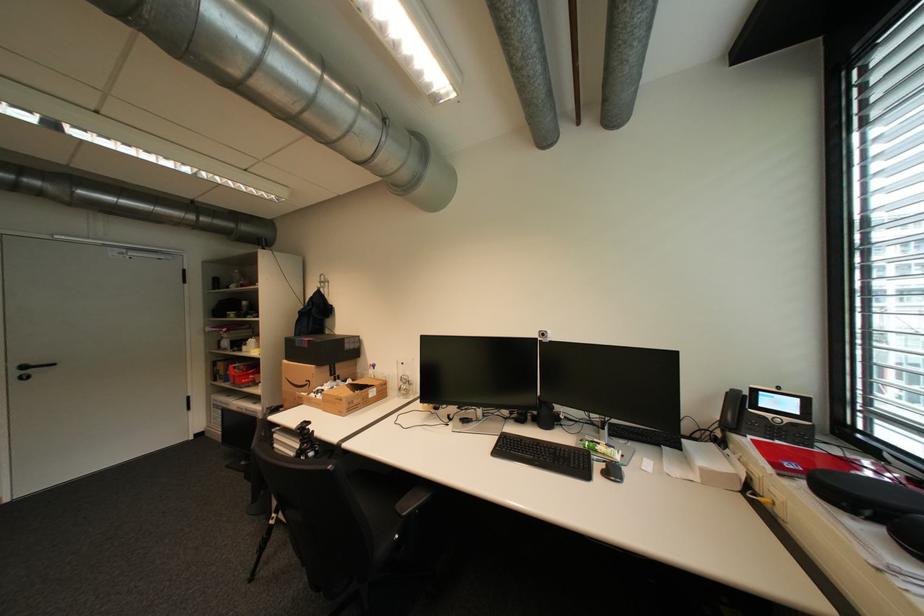
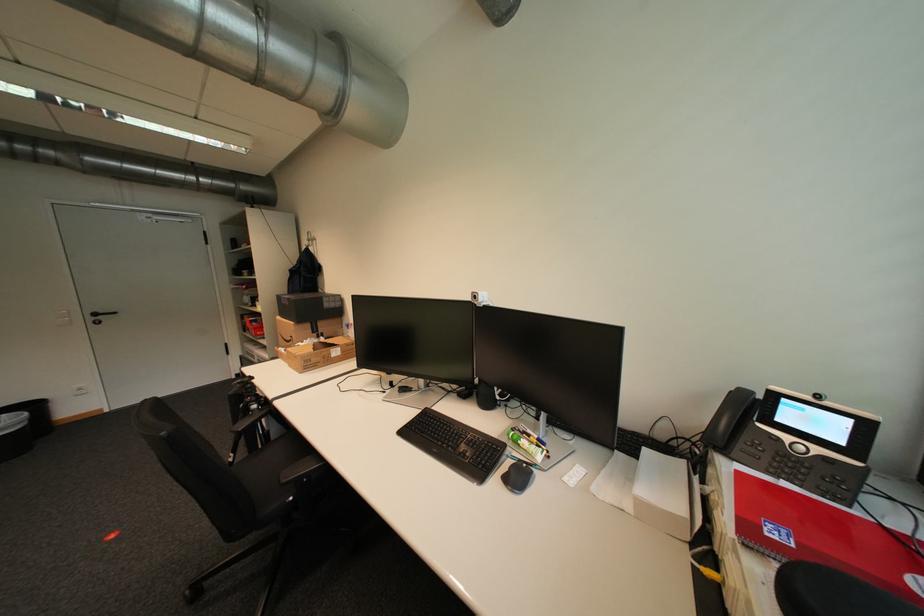
Locate, in the second image, the point that corresponds to (360,407) in the first image.

(319, 365)